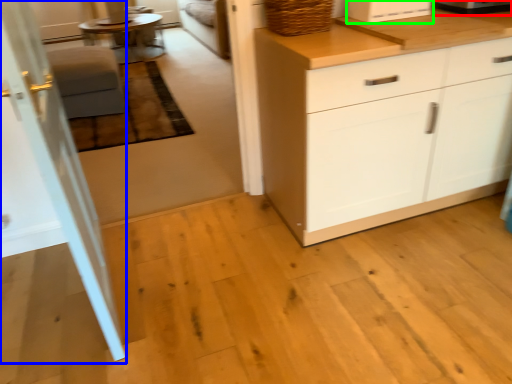
Question: Considering the real-world distances, which object is farthest from appliance (highlighted by a red box)? screen door (highlighted by a blue box) or appliance (highlighted by a green box)?

Choices:
 (A) screen door
 (B) appliance

Answer: (A)